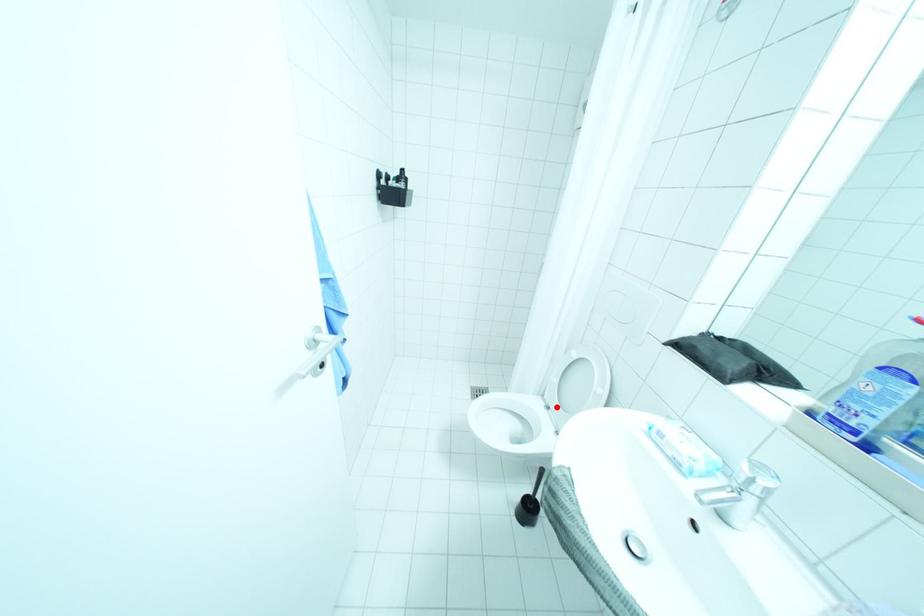
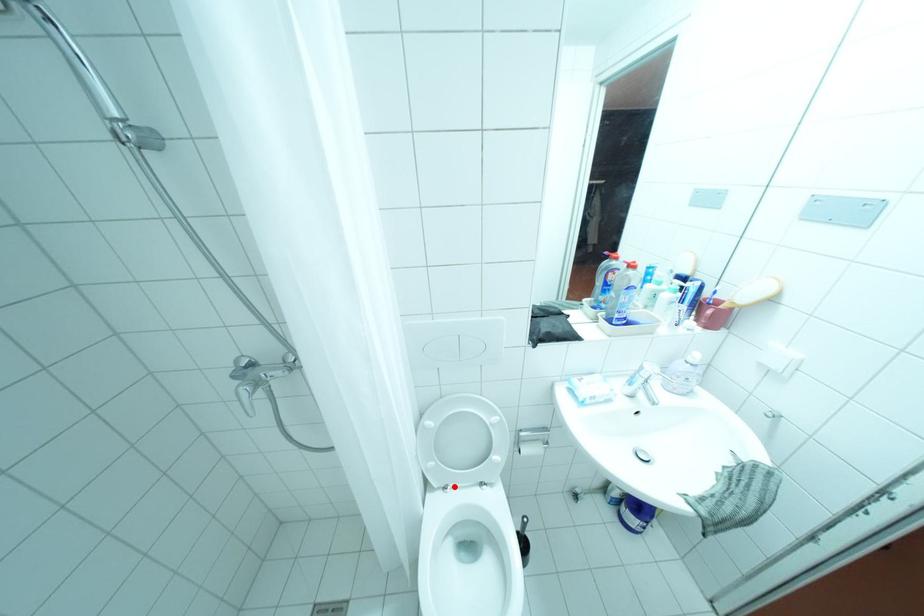
I am providing you with two images of the same scene from different viewpoints. A red point is marked on the first image and another point is marked on the second image. Are the points marked in image1 and image2 representing the same 3D position?

Yes